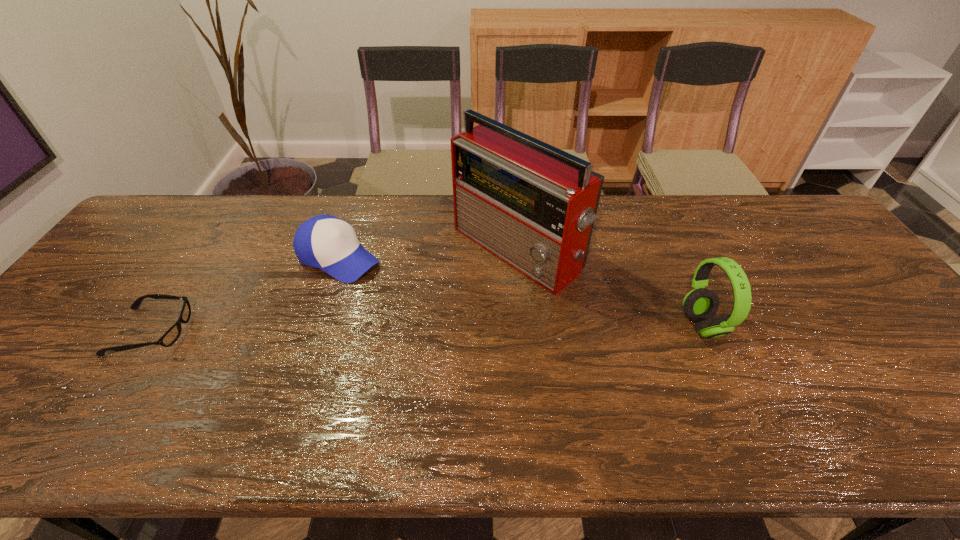
Where is `the leftmost object`? the leftmost object is located at coordinates click(x=170, y=337).

Image resolution: width=960 pixels, height=540 pixels. Find the location of `spectacles`. spectacles is located at coordinates pyautogui.click(x=170, y=337).

Identify the location of the second tallest object. The width and height of the screenshot is (960, 540). (701, 304).

In order to click on the rightmost object in this screenshot , I will do `click(701, 304)`.

Where is `radio receiver`? The width and height of the screenshot is (960, 540). radio receiver is located at coordinates (530, 204).

At what (x,y) coordinates should I click in order to perform the action: click on the second object from right to left. Please return your answer as a coordinate pair (x, y). The height and width of the screenshot is (540, 960). Looking at the image, I should click on (530, 204).

The width and height of the screenshot is (960, 540). What are the coordinates of `the second object from left to right` in the screenshot? It's located at (326, 242).

This screenshot has width=960, height=540. What are the coordinates of `the third tallest object` in the screenshot? It's located at (326, 242).

Where is `blank space located 0.310m on the front-facing side of the leftmost object`? Image resolution: width=960 pixels, height=540 pixels. blank space located 0.310m on the front-facing side of the leftmost object is located at coordinates (312, 332).

Identify the location of blank space located on the back of the third shortest object. (655, 222).